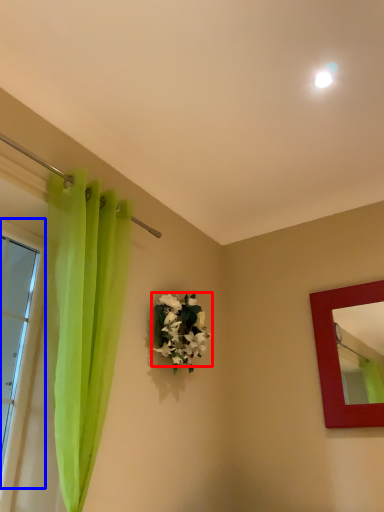
Question: Which point is closer to the camera, flower (highlighted by a red box) or window (highlighted by a blue box)?

Choices:
 (A) flower
 (B) window

Answer: (B)